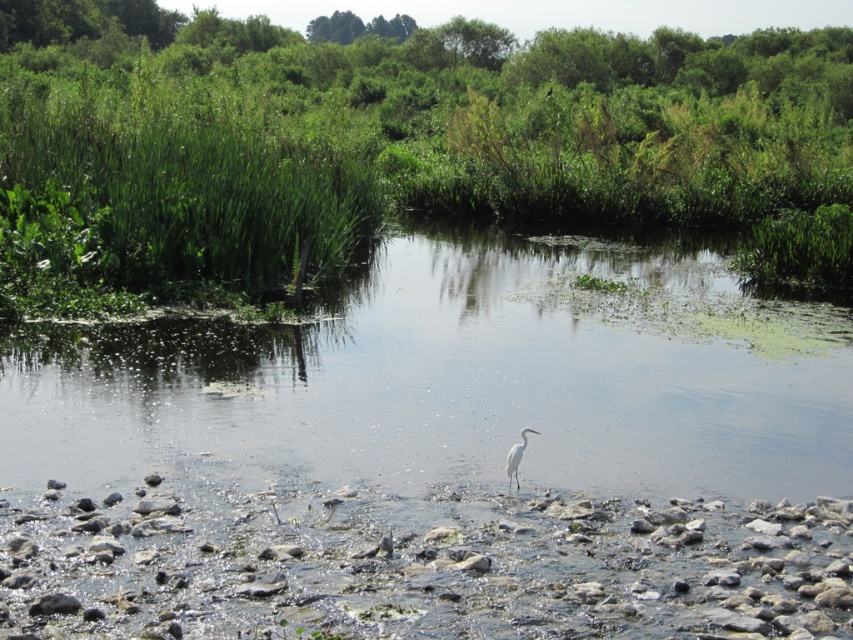
You are a photographer trying to capture the white matte bird at center in the image. The green grass at center is blocking your view. Can you adjust your position to see the bird clearly?

The green grass at center is much taller than the white matte bird at center, so moving to a higher position would allow you to see above the grass and get a clear view of the bird.

You are standing at the edge of the water and want to reach the green grass at center. Based on the coordinates provided, in which direction should you move to get there?

The green grass at center is located at coordinates point (395, 131). Since the coordinates are relative to the image, moving towards the center from the edge of the water would involve heading towards the middle of the scene.